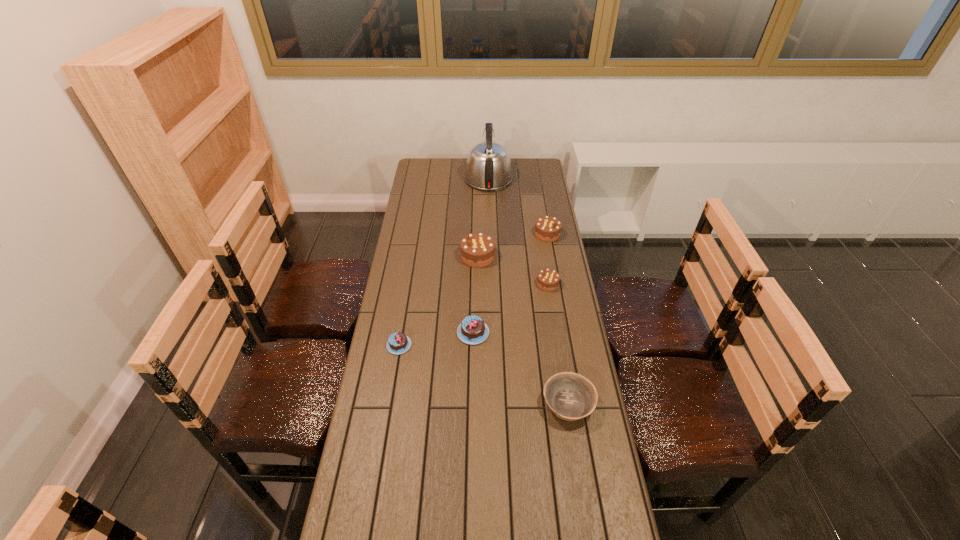
Locate an element on the screen. Image resolution: width=960 pixels, height=540 pixels. vacant space that's between the farthest brown chocolate cake and the nearest object is located at coordinates (558, 319).

You are a GUI agent. You are given a task and a screenshot of the screen. Output one action in this format:
    pyautogui.click(x=<x>, y=<y>)
    Task: Click on the vacant point located between the bowl and the leftmost brown chocolate cake
    This screenshot has height=540, width=960.
    Given the screenshot: What is the action you would take?
    pyautogui.click(x=523, y=330)

I want to click on free space between the second biggest brown chocolate cake and the smallest brown chocolate cake, so click(547, 259).

Image resolution: width=960 pixels, height=540 pixels. Identify the location of vacant space in between the right pink chocolate cake and the nearest object. (520, 368).

Where is `the sixth closest object to the leftmost object`? the sixth closest object to the leftmost object is located at coordinates (488, 167).

Choose which object is the fifth nearest neighbor to the kettle. Please provide its 2D coordinates. Your answer should be formatted as a tuple, i.e. [(x, y)], where the tuple contains the x and y coordinates of a point satisfying the conditions above.

[(398, 343)]

The height and width of the screenshot is (540, 960). I want to click on the fourth closest chocolate cake to the farthest brown chocolate cake, so click(x=398, y=343).

Locate which chocolate cake ranks second in proximity to the third nearest chocolate cake. Please provide its 2D coordinates. Your answer should be formatted as a tuple, i.e. [(x, y)], where the tuple contains the x and y coordinates of a point satisfying the conditions above.

[(547, 228)]

This screenshot has height=540, width=960. I want to click on the closest brown chocolate cake to the fourth nearest object, so click(477, 250).

Point out which brown chocolate cake is positioned as the nearest to the tallest object. Please provide its 2D coordinates. Your answer should be formatted as a tuple, i.e. [(x, y)], where the tuple contains the x and y coordinates of a point satisfying the conditions above.

[(547, 228)]